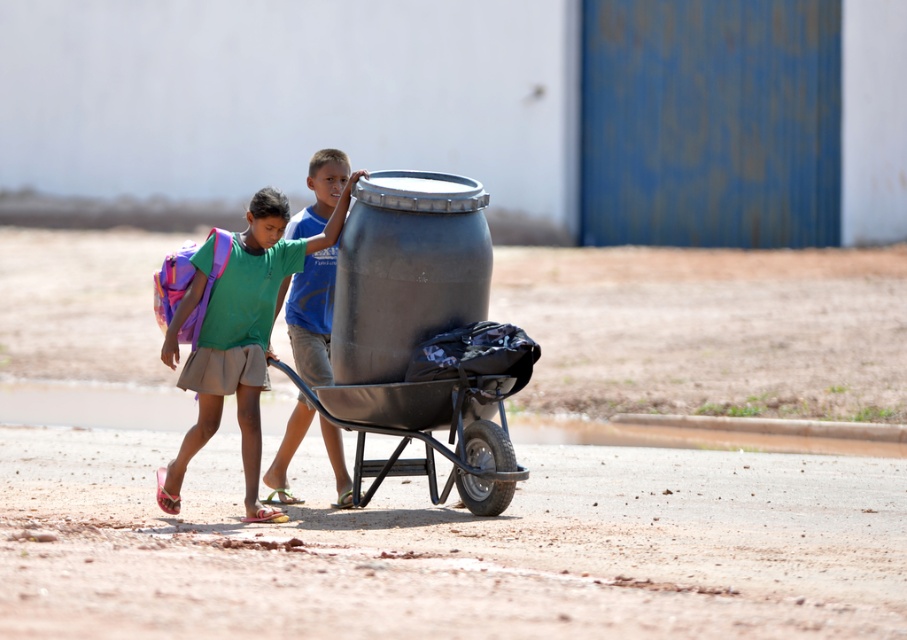
You are a delivery person who needs to place a package on the highest point of the green fabric backpack at left and the black metal wheelbarrow at center. Which object should you choose to ensure the package is placed higher?

The green fabric backpack at left has a greater height compared to the black metal wheelbarrow at center, so you should place the package on the green fabric backpack at left to ensure it is placed higher.

You are a delivery person who needs to place a package that is 22 inches long into the wheelbarrow. The wheelbarrow has the green fabric backpack at left and the brushed metal barrel at center. Can the package fit between them?

The green fabric backpack at left is 21.70 inches from the brushed metal barrel at center. Since the package is 22 inches long, it cannot fit between them because the distance between the backpack and barrel is slightly shorter than the package length.